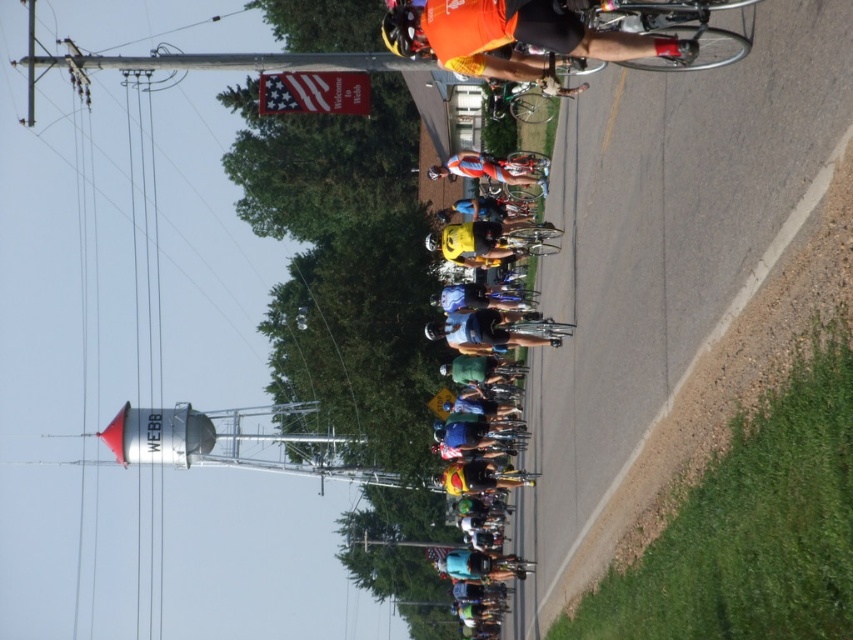
Consider the image. What is the 2D coordinate of the american flag banner at upper center in the image?

The american flag banner at upper center is located at the coordinate point of (x=314, y=92).

You are a photographer positioned at the side of the road capturing the cyclists. You want to ensure that both the american flag banner at upper center and the orange jersey cyclist at center are clearly visible in your shot. Based on their sizes, which object should you focus on to ensure they are both in frame?

The american flag banner at upper center might be wider than orange jersey cyclist at center, so focusing on the wider object first would help ensure both are in frame.